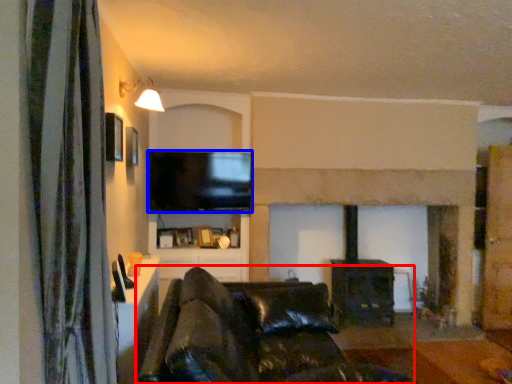
Question: Which point is closer to the camera, studio couch (highlighted by a red box) or television (highlighted by a blue box)?

Choices:
 (A) studio couch
 (B) television

Answer: (A)